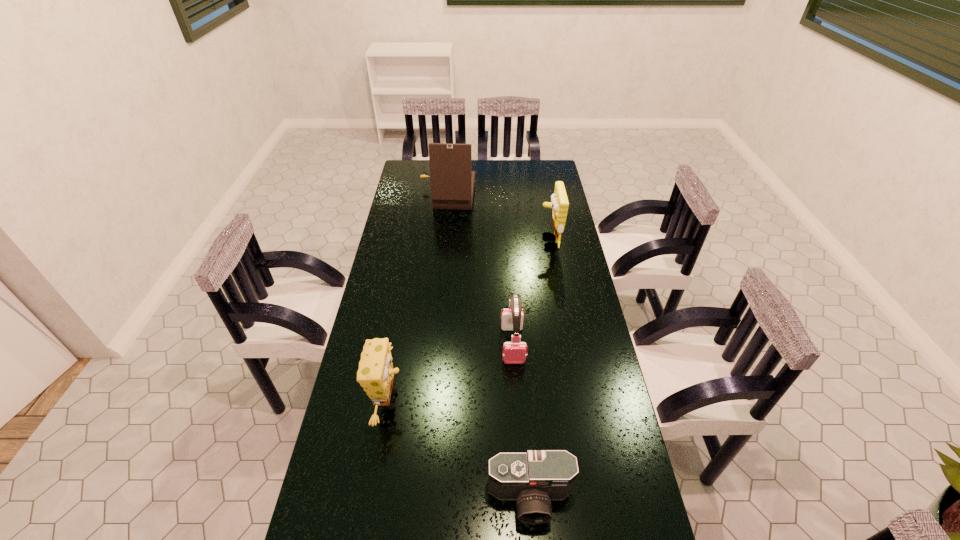
At what (x,y) coordinates should I click in order to perform the action: click on vacant space at the far edge of the desktop. Please return your answer as a coordinate pair (x, y). This screenshot has height=540, width=960. Looking at the image, I should click on (484, 165).

The width and height of the screenshot is (960, 540). What are the coordinates of `free region at the left edge` in the screenshot? It's located at (396, 192).

This screenshot has height=540, width=960. Find the location of `vacant space at the right edge of the desktop`. vacant space at the right edge of the desktop is located at coordinates (573, 271).

Identify the location of free region at the far left corner of the desktop. (428, 172).

In the image, there is a desktop. Where is `vacant space at the far right corner`? Image resolution: width=960 pixels, height=540 pixels. vacant space at the far right corner is located at coordinates (530, 178).

This screenshot has width=960, height=540. Identify the location of empty space between the fourth nearest object and the shortest object. (540, 370).

Locate an element on the screen. free space between the tallest object and the shortest object is located at coordinates (489, 347).

The image size is (960, 540). In order to click on empty space between the earphone and the nearer sponge in this screenshot , I will do `click(450, 373)`.

The image size is (960, 540). In order to click on blank region between the nearest object and the nearer sponge in this screenshot , I will do `click(460, 449)`.

The width and height of the screenshot is (960, 540). Find the location of `unoccupied position between the left sponge and the second farthest object`. unoccupied position between the left sponge and the second farthest object is located at coordinates (468, 321).